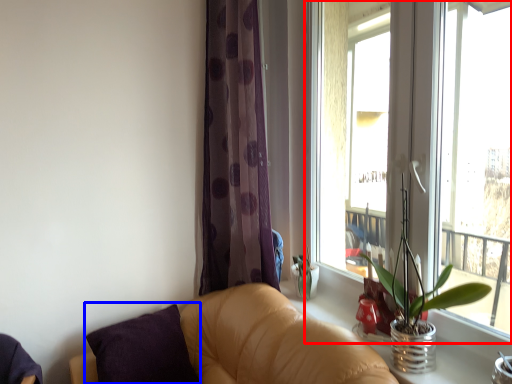
Question: Which object is further to the camera taking this photo, window (highlighted by a red box) or pillow (highlighted by a blue box)?

Choices:
 (A) window
 (B) pillow

Answer: (B)